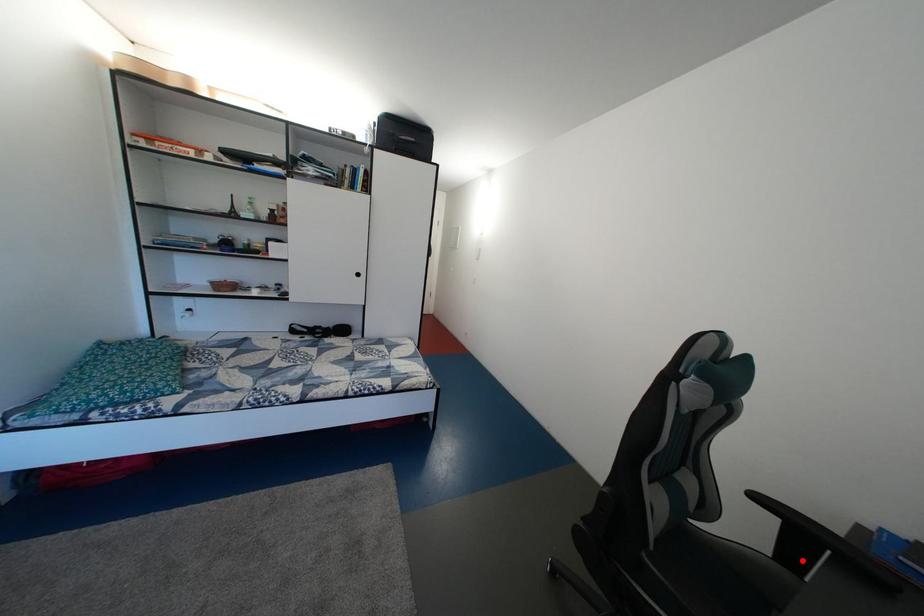
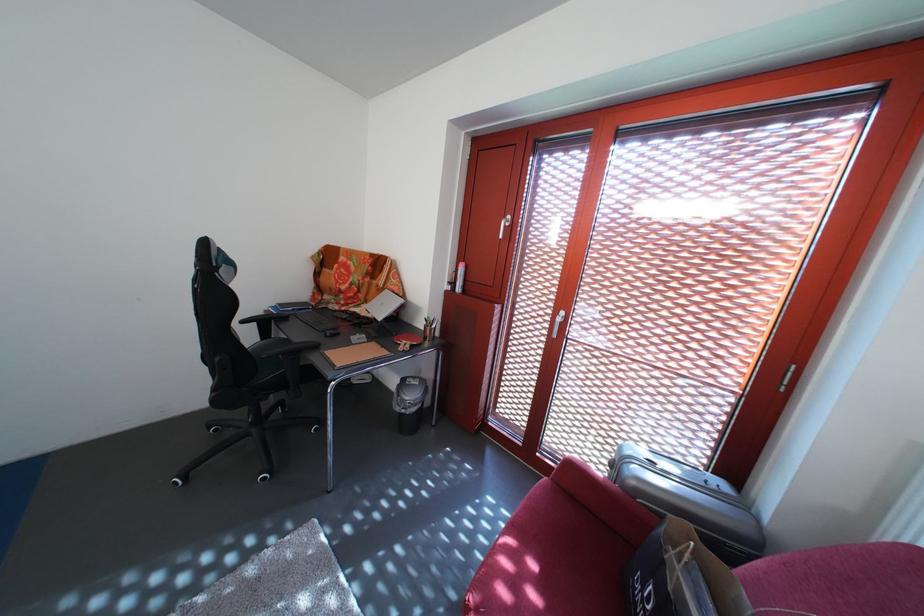
Find the pixel in the second image that matches the highlighted location in the first image.

(275, 339)